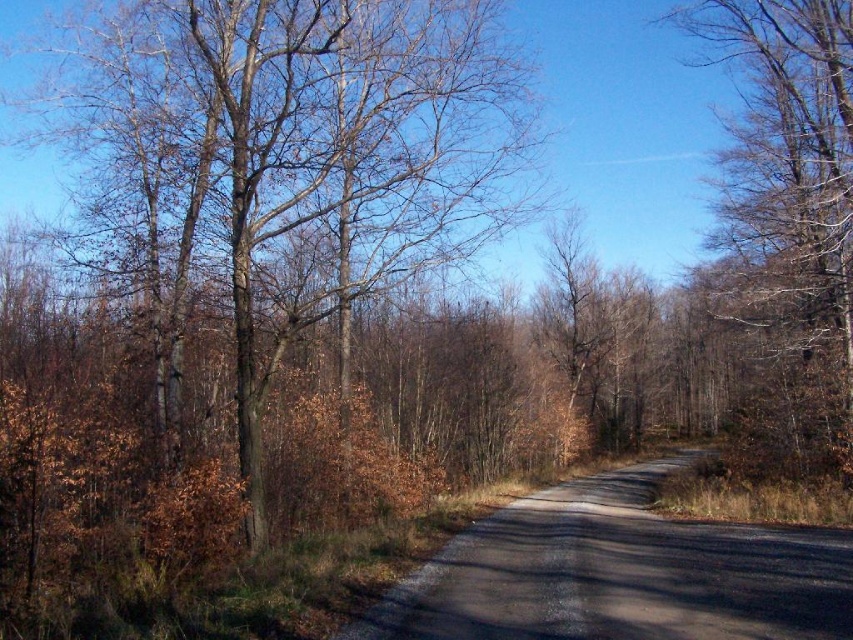
Does point (102, 145) come in front of point (811, 282)?

Yes, point (102, 145) is in front of point (811, 282).

Which is behind, point (515, 112) or point (753, 211)?

Point (753, 211)

Locate an element on the screen. brown bark tree at left is located at coordinates (297, 154).